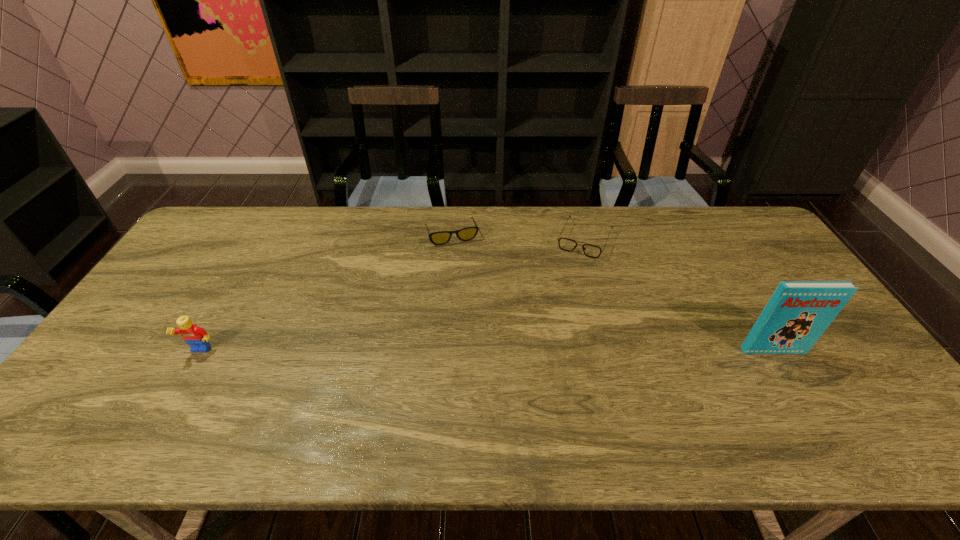
Where is `unoccupied position between the third shortest object and the book`? Image resolution: width=960 pixels, height=540 pixels. unoccupied position between the third shortest object and the book is located at coordinates (487, 351).

The image size is (960, 540). Find the location of `free space between the second object from left to right and the second tallest object`. free space between the second object from left to right and the second tallest object is located at coordinates (326, 293).

Identify the location of vacant area between the second object from left to right and the tallest object. (612, 293).

At what (x,y) coordinates should I click in order to perform the action: click on vacant space in between the third object from left to right and the third object from right to left. Please return your answer as a coordinate pair (x, y). The width and height of the screenshot is (960, 540). Looking at the image, I should click on tap(518, 237).

Identify the location of free space between the second object from left to right and the third object from left to right. This screenshot has height=540, width=960. (518, 237).

Locate an element on the screen. free space between the right sunglasses and the tallest object is located at coordinates (679, 295).

You are a GUI agent. You are given a task and a screenshot of the screen. Output one action in this format:
    pyautogui.click(x=<x>, y=<y>)
    Task: Click on the unoccupied area between the third object from left to right and the second tallest object
    
    Given the screenshot: What is the action you would take?
    pyautogui.click(x=393, y=296)

Find the location of a particular element. free space that is in between the right sunglasses and the second tallest object is located at coordinates (393, 296).

This screenshot has width=960, height=540. In order to click on blank region between the left sunglasses and the tallest object in this screenshot , I will do `click(612, 293)`.

Identify which object is located as the nearest to the Lego. Please provide its 2D coordinates. Your answer should be formatted as a tuple, i.e. [(x, y)], where the tuple contains the x and y coordinates of a point satisfying the conditions above.

[(465, 234)]